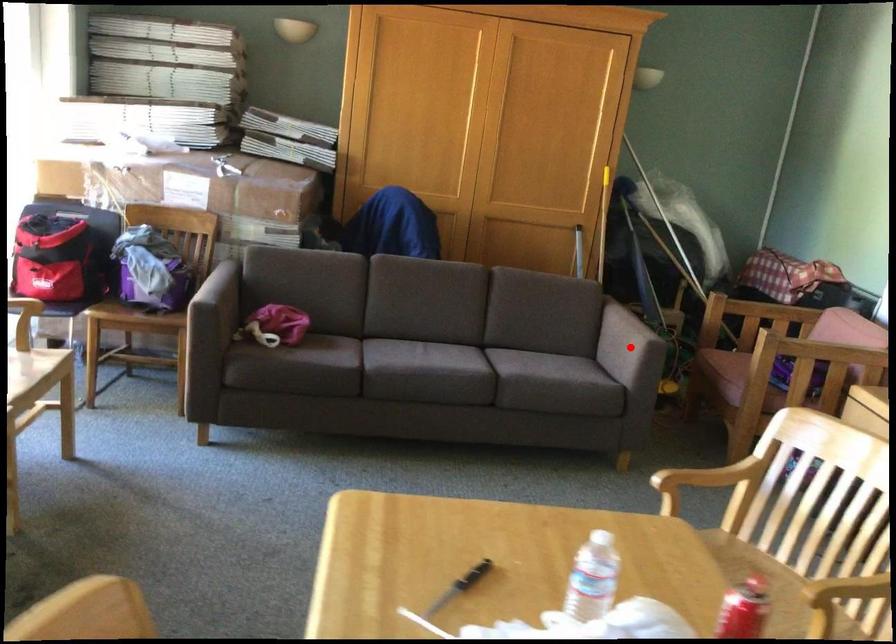
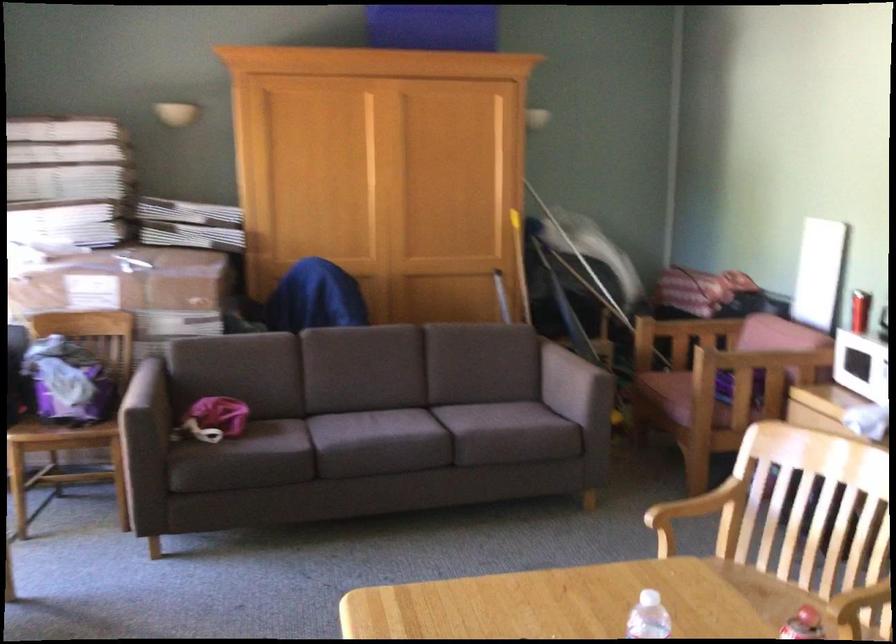
In the second image, find the point that corresponds to the highlighted location in the first image.

(574, 386)